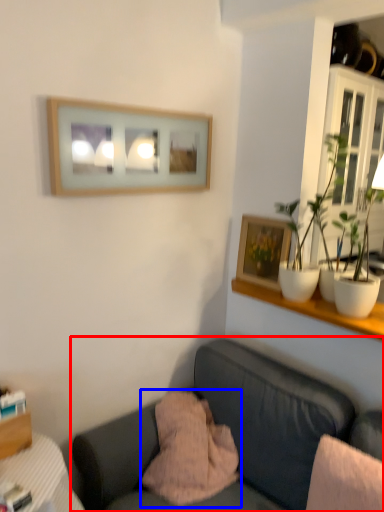
Question: Which of the following is the closest to the observer, studio couch (highlighted by a red box) or pillow (highlighted by a blue box)?

Choices:
 (A) studio couch
 (B) pillow

Answer: (A)